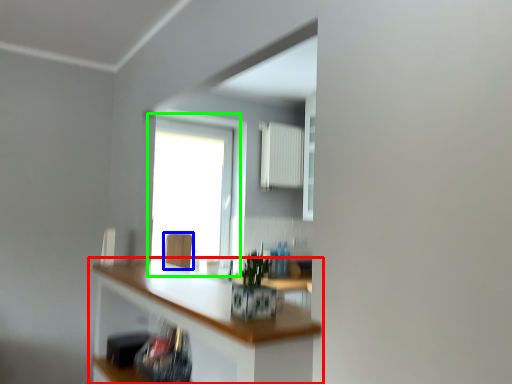
Question: Which object is the closest to the countertop (highlighted by a red box)? Choose among these: swivel chair (highlighted by a blue box) or window (highlighted by a green box).

Choices:
 (A) swivel chair
 (B) window

Answer: (A)